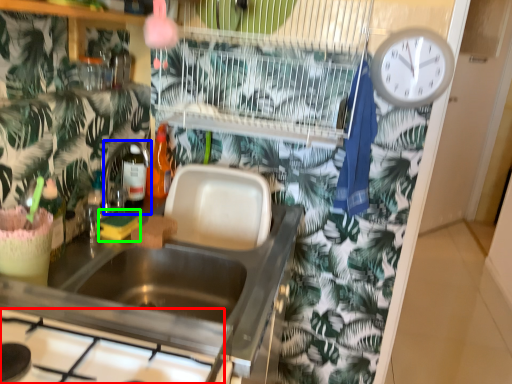
Question: Which is nearer to the gas stove (highlighted by a red box)? faucet (highlighted by a blue box) or food (highlighted by a green box).

Choices:
 (A) faucet
 (B) food

Answer: (B)